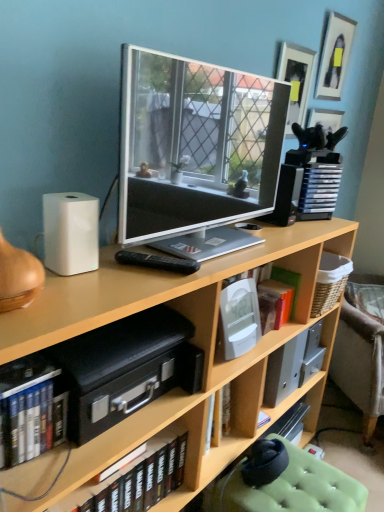
You are a GUI agent. You are given a task and a screenshot of the screen. Output one action in this format:
    pyautogui.click(x=<x>, y=<y>)
    Task: Click on the free point in front of white matte speaker at left, acting as the second speaker starting from the right
    
    Given the screenshot: What is the action you would take?
    pyautogui.click(x=77, y=293)